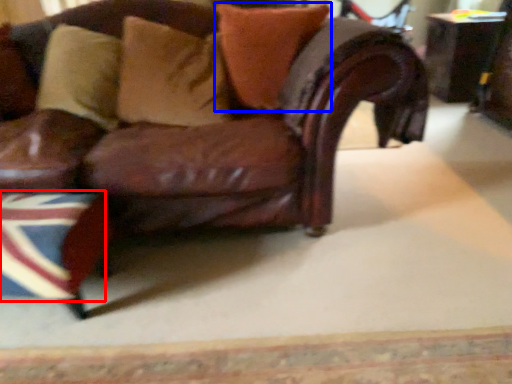
Question: Among these objects, which one is farthest to the camera, flag (highlighted by a red box) or pillow (highlighted by a blue box)?

Choices:
 (A) flag
 (B) pillow

Answer: (B)